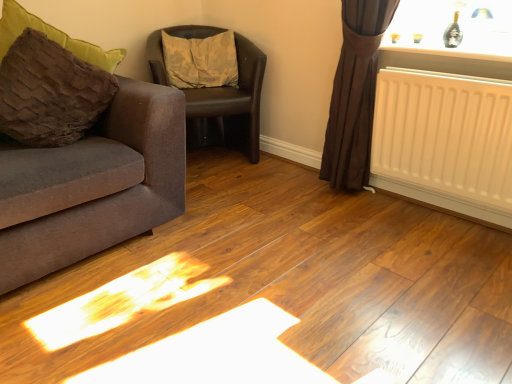
Question: Based on their positions, is white plastic radiator at upper right located to the left or right of brown leather chair at center?

Choices:
 (A) left
 (B) right

Answer: (B)

Question: Is white plastic radiator at upper right in front of or behind brown leather chair at center in the image?

Choices:
 (A) front
 (B) behind

Answer: (A)

Question: Considering the real-world distances, which object is farthest from the brown leather chair at center?

Choices:
 (A) camouflage fabric pillow at center, the 2th pillow viewed from the front
 (B) white matte radiator at right
 (C) white plastic radiator at upper right
 (D) brown fuzzy pillow at left, which ranks as the second pillow in right-to-left order
 (E) matte gray couch at left

Answer: (B)

Question: Estimate the real-world distances between objects in this image. Which object is farther from the brown fuzzy pillow at left, the 1th pillow in the front-to-back sequence?

Choices:
 (A) white matte radiator at right
 (B) matte gray couch at left
 (C) brown leather chair at center
 (D) camouflage fabric pillow at center, the 2th pillow viewed from the front
 (E) white plastic radiator at upper right

Answer: (E)